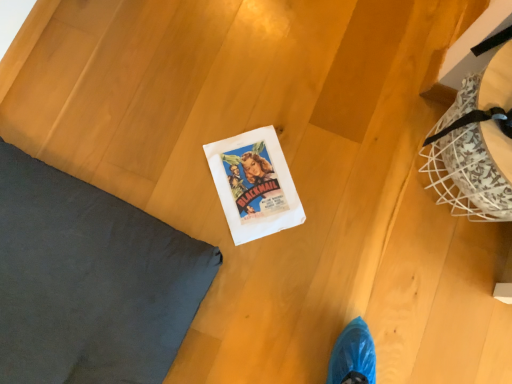
Question: From a real-world perspective, is white paper comic book at center above or below dark gray fabric pillow at upper left?

Choices:
 (A) below
 (B) above

Answer: (A)

Question: Does point (283, 210) appear closer or farther from the camera than point (45, 284)?

Choices:
 (A) farther
 (B) closer

Answer: (A)

Question: Is white paper comic book at center in front of or behind dark gray fabric pillow at upper left in the image?

Choices:
 (A) behind
 (B) front

Answer: (A)

Question: Considering the positions of dark gray fabric pillow at upper left and white paper comic book at center in the image, is dark gray fabric pillow at upper left bigger or smaller than white paper comic book at center?

Choices:
 (A) big
 (B) small

Answer: (A)

Question: From their relative heights in the image, would you say dark gray fabric pillow at upper left is taller or shorter than white paper comic book at center?

Choices:
 (A) short
 (B) tall

Answer: (B)

Question: In terms of width, does dark gray fabric pillow at upper left look wider or thinner when compared to white paper comic book at center?

Choices:
 (A) thin
 (B) wide

Answer: (B)

Question: Relative to white paper comic book at center, is dark gray fabric pillow at upper left in front or behind?

Choices:
 (A) behind
 (B) front

Answer: (B)